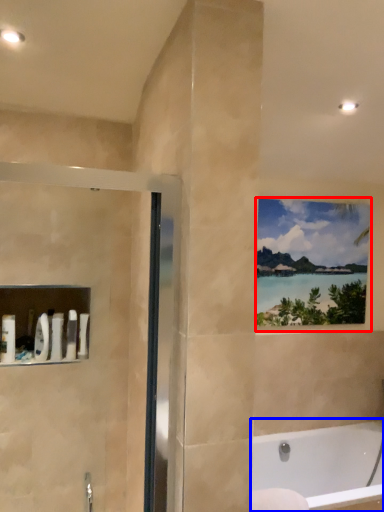
Question: Which object is closer to the camera taking this photo, window (highlighted by a red box) or bathtub (highlighted by a blue box)?

Choices:
 (A) window
 (B) bathtub

Answer: (B)